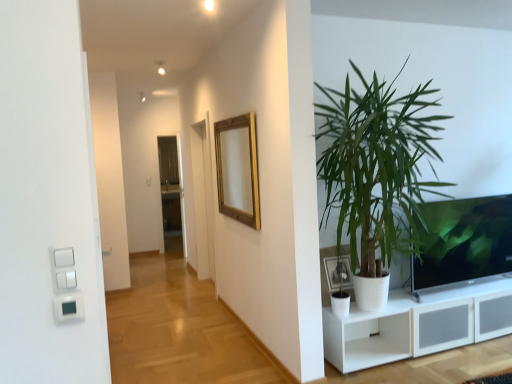
Question: Does gold wooden mirror at upper center lie in front of matte black tv at right?

Choices:
 (A) no
 (B) yes

Answer: (B)

Question: Does gold wooden mirror at upper center have a greater height compared to matte black tv at right?

Choices:
 (A) yes
 (B) no

Answer: (A)

Question: From a real-world perspective, is gold wooden mirror at upper center over matte black tv at right?

Choices:
 (A) yes
 (B) no

Answer: (A)

Question: Are gold wooden mirror at upper center and matte black tv at right located far from each other?

Choices:
 (A) yes
 (B) no

Answer: (A)

Question: Is gold wooden mirror at upper center oriented towards matte black tv at right?

Choices:
 (A) no
 (B) yes

Answer: (A)

Question: Visually, is white plastic light switch at lower left positioned to the left or to the right of matte black picture frame at lower right?

Choices:
 (A) right
 (B) left

Answer: (B)

Question: Looking at the image, does white plastic light switch at lower left seem bigger or smaller compared to matte black picture frame at lower right?

Choices:
 (A) small
 (B) big

Answer: (A)

Question: From a real-world perspective, is white plastic light switch at lower left above or below matte black picture frame at lower right?

Choices:
 (A) below
 (B) above

Answer: (B)

Question: Is white plastic light switch at lower left taller or shorter than matte black picture frame at lower right?

Choices:
 (A) tall
 (B) short

Answer: (B)

Question: In terms of height, does white plastic light switch at lower left look taller or shorter compared to green leafy plant at right?

Choices:
 (A) short
 (B) tall

Answer: (A)

Question: Considering their positions, is white plastic light switch at lower left located in front of or behind green leafy plant at right?

Choices:
 (A) front
 (B) behind

Answer: (A)

Question: In terms of size, does white plastic light switch at lower left appear bigger or smaller than green leafy plant at right?

Choices:
 (A) big
 (B) small

Answer: (B)

Question: Considering the relative positions of white plastic light switch at lower left and green leafy plant at right in the image provided, is white plastic light switch at lower left to the left or to the right of green leafy plant at right?

Choices:
 (A) right
 (B) left

Answer: (B)

Question: Is white plastic light switch at lower left to the left or to the right of gold wooden mirror at upper center in the image?

Choices:
 (A) right
 (B) left

Answer: (B)

Question: Considering the positions of white plastic light switch at lower left and gold wooden mirror at upper center in the image, is white plastic light switch at lower left wider or thinner than gold wooden mirror at upper center?

Choices:
 (A) wide
 (B) thin

Answer: (B)